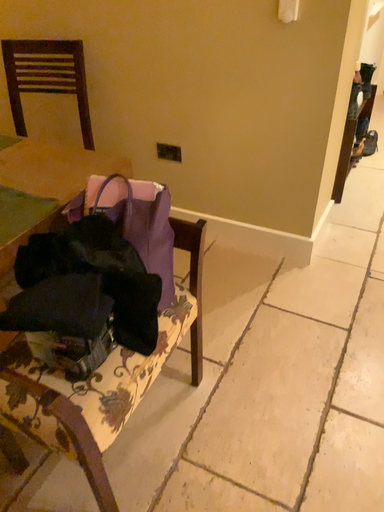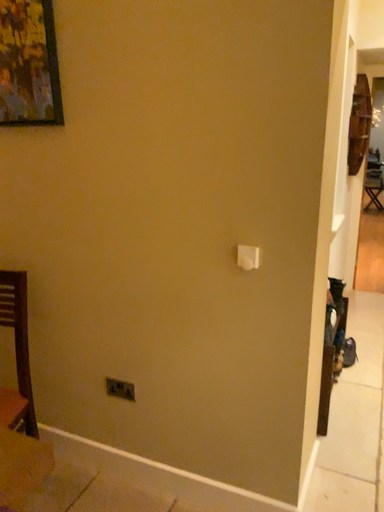
Question: How did the camera likely rotate when shooting the video?

Choices:
 (A) rotated upward
 (B) rotated downward

Answer: (A)